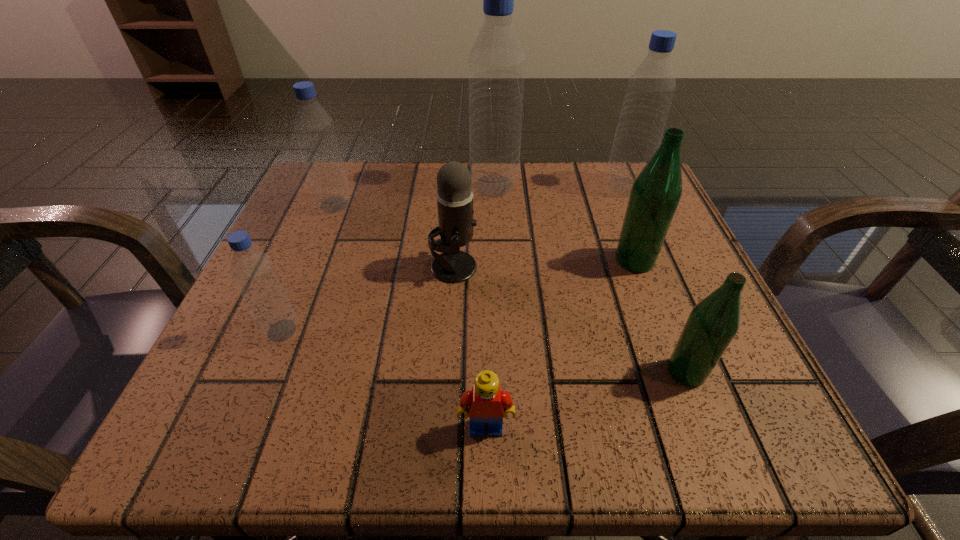
Where is `free space at the far left corner of the desktop`? The width and height of the screenshot is (960, 540). free space at the far left corner of the desktop is located at coordinates (294, 219).

At what (x,y) coordinates should I click in order to perform the action: click on vacant space at the near right corner of the desktop. Please return your answer as a coordinate pair (x, y). This screenshot has height=540, width=960. Looking at the image, I should click on (661, 394).

The image size is (960, 540). I want to click on empty space between the smallest blue bottle and the bigger green bottle, so click(x=458, y=295).

At what (x,y) coordinates should I click in order to perform the action: click on free spot between the shortest object and the gray microphone. Please return your answer as a coordinate pair (x, y). This screenshot has height=540, width=960. Looking at the image, I should click on (469, 347).

The height and width of the screenshot is (540, 960). Identify the location of free space between the second smallest blue bottle and the tallest object. (415, 195).

The image size is (960, 540). What are the coordinates of `unoccupied area between the tallest bottle and the farther green bottle` in the screenshot? It's located at (564, 223).

Find the location of a particular element. This screenshot has height=540, width=960. unoccupied area between the microphone and the smaller green bottle is located at coordinates (570, 320).

What are the coordinates of `empty space between the smaller green bottle and the second smallest blue bottle` in the screenshot? It's located at (511, 288).

At what (x,y) coordinates should I click in order to perform the action: click on free space between the third nearest bottle and the second nearest bottle. Please return your answer as a coordinate pair (x, y). The height and width of the screenshot is (540, 960). Looking at the image, I should click on (458, 295).

Locate an element on the screen. The width and height of the screenshot is (960, 540). free point between the fourth farthest bottle and the third biggest blue bottle is located at coordinates (485, 233).